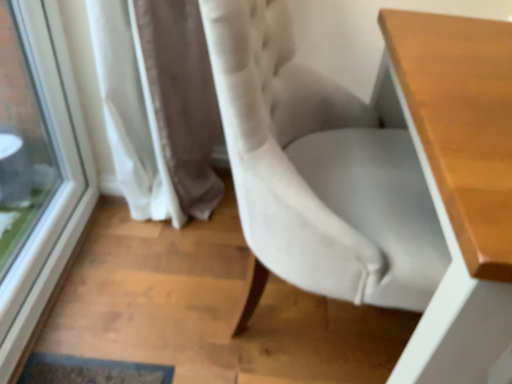
Question: Is wooden table at right taller than velvet white chair at center?

Choices:
 (A) yes
 (B) no

Answer: (B)

Question: Considering the relative sizes of wooden table at right and velvet white chair at center in the image provided, is wooden table at right thinner than velvet white chair at center?

Choices:
 (A) no
 (B) yes

Answer: (A)

Question: From the image's perspective, is wooden table at right below velvet white chair at center?

Choices:
 (A) no
 (B) yes

Answer: (B)

Question: Can you confirm if wooden table at right is wider than velvet white chair at center?

Choices:
 (A) no
 (B) yes

Answer: (B)

Question: From the image's perspective, is wooden table at right located above velvet white chair at center?

Choices:
 (A) yes
 (B) no

Answer: (B)

Question: Considering the relative sizes of wooden table at right and velvet white chair at center in the image provided, is wooden table at right bigger than velvet white chair at center?

Choices:
 (A) yes
 (B) no

Answer: (A)

Question: Is velvet white chair at center a part of transparent glass window at left?

Choices:
 (A) yes
 (B) no

Answer: (B)

Question: From the image's perspective, is transparent glass window at left under velvet white chair at center?

Choices:
 (A) no
 (B) yes

Answer: (A)

Question: Is transparent glass window at left aimed at velvet white chair at center?

Choices:
 (A) no
 (B) yes

Answer: (B)

Question: Considering the relative positions of transparent glass window at left and velvet white chair at center in the image provided, is transparent glass window at left to the left of velvet white chair at center from the viewer's perspective?

Choices:
 (A) no
 (B) yes

Answer: (B)

Question: Considering the relative sizes of transparent glass window at left and velvet white chair at center in the image provided, is transparent glass window at left bigger than velvet white chair at center?

Choices:
 (A) no
 (B) yes

Answer: (A)

Question: Is transparent glass window at left smaller than velvet white chair at center?

Choices:
 (A) yes
 (B) no

Answer: (A)

Question: Is transparent glass window at left smaller than wooden table at right?

Choices:
 (A) no
 (B) yes

Answer: (B)